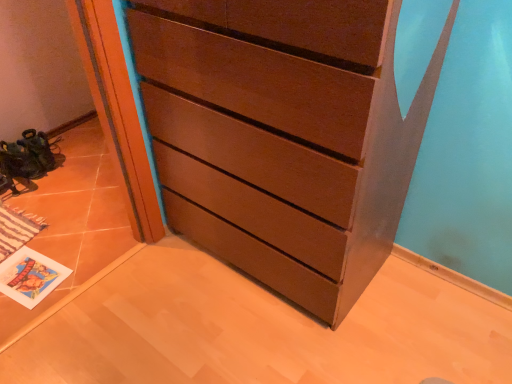
Question: Should I look upward or downward to see matte brown chest of drawers at center?

Choices:
 (A) up
 (B) down

Answer: (A)